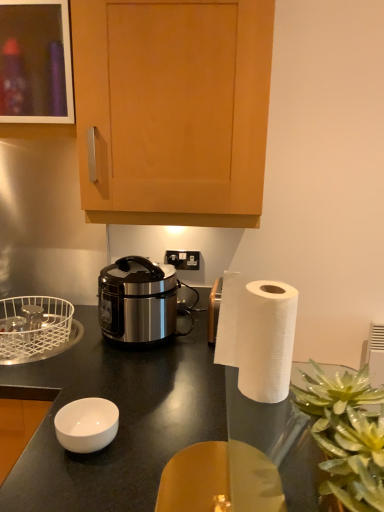
The image size is (384, 512). Find the location of `space that is in front of white glossy bowl at lower left`. space that is in front of white glossy bowl at lower left is located at coordinates (84, 486).